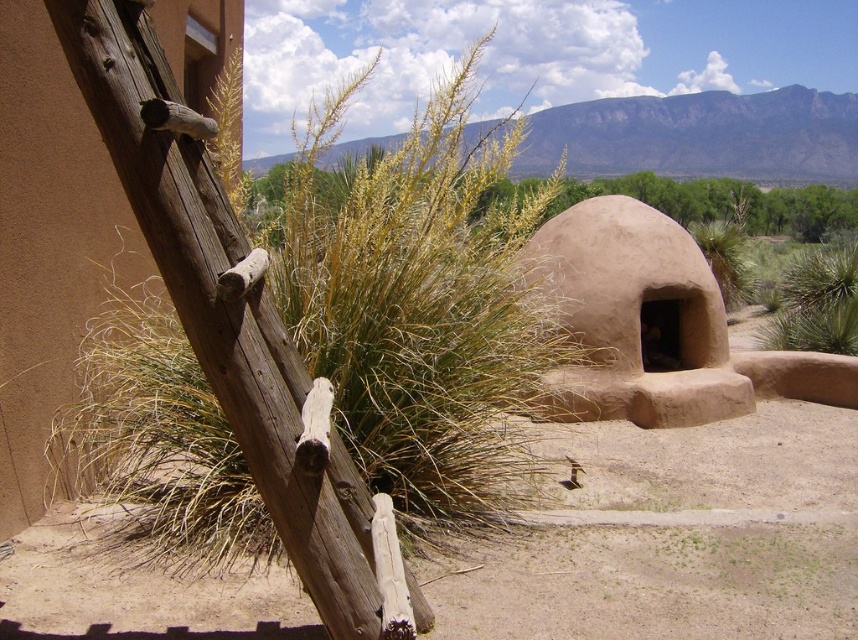
You are a hiker who wants to cross from the wooden ladder to the entrance of the dome structure. The path is covered with dry grass at left and yellow grass at center. Which grass area should you avoid stepping on if you want to stay on the more stable ground?

The dry grass at left is positioned on the left side of yellow grass at center. Dry grass is typically less stable than yellow grass, so you should avoid stepping on the dry grass at left to stay on more stable ground.

You are a gardener who wants to plant new flowers in the desert area. You notice dry grass at left and yellow grass at center. Which area would be better for planting based on their height?

The yellow grass at center is taller than the dry grass at left, so planting in the area with yellow grass at center might be better as taller vegetation could indicate more fertile soil or better growing conditions.